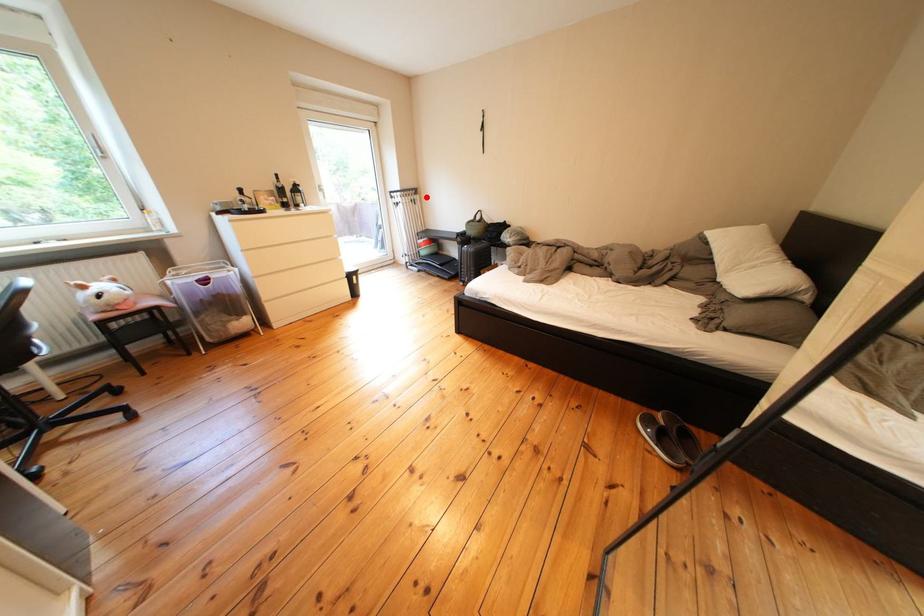
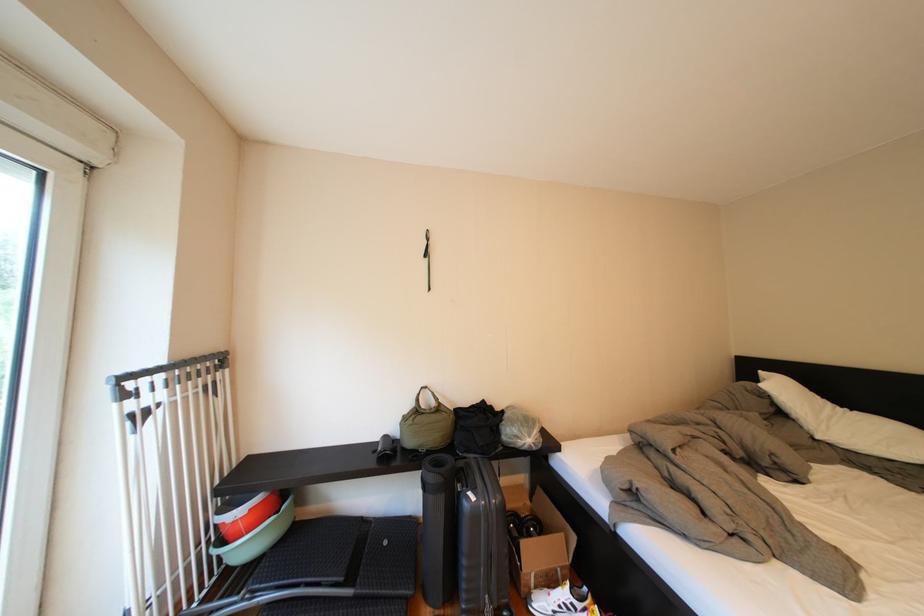
Locate, in the second image, the point that corresponds to the highlighted location in the first image.

(224, 369)